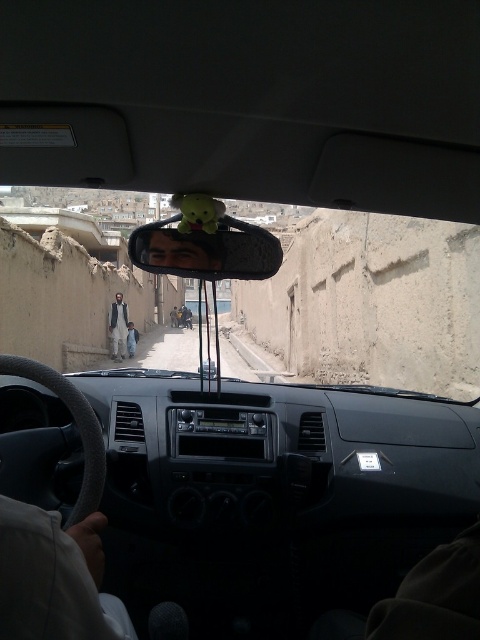
Is matte plastic mirror at center bigger than light brown textured jacket at center?

Yes.

Can you confirm if matte plastic mirror at center is wider than light brown textured jacket at center?

Yes, matte plastic mirror at center is wider than light brown textured jacket at center.

Measure the distance between point (228, 252) and camera.

Point (228, 252) and camera are 17.49 meters apart.

Where is `matte plastic mirror at center`? matte plastic mirror at center is located at coordinates (206, 250).

Who is positioned more to the right, matte plastic mirror at center or light brown fabric jacket at left?

matte plastic mirror at center

Between matte plastic mirror at center and light brown fabric jacket at left, which one appears on the left side from the viewer's perspective?

Positioned to the left is light brown fabric jacket at left.

Who is more distant from viewer, (261, 264) or (132, 336)?

Point (132, 336)

Where is `matte plastic mirror at center`? The image size is (480, 640). matte plastic mirror at center is located at coordinates (206, 250).

Is light brown textured jacket at center to the right of light brown fabric jacket at left from the viewer's perspective?

No, light brown textured jacket at center is not to the right of light brown fabric jacket at left.

Is point (126, 328) farther from camera compared to point (132, 326)?

No, it is not.

Locate an element on the screen. The width and height of the screenshot is (480, 640). light brown textured jacket at center is located at coordinates (118, 326).